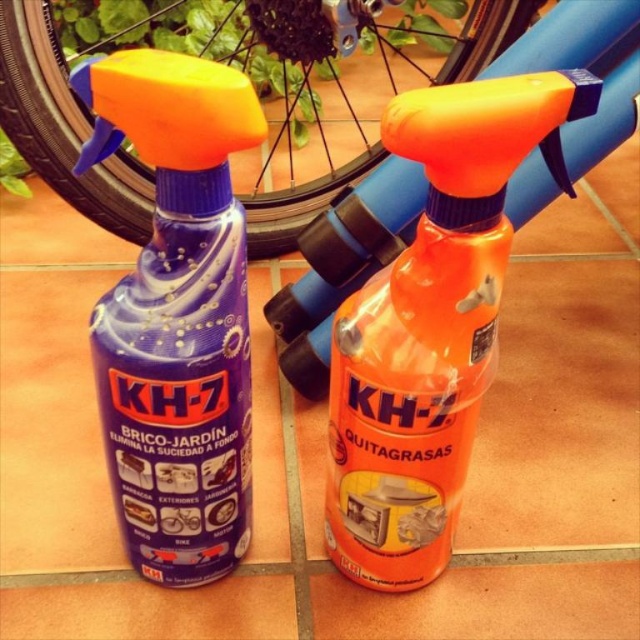
Does matte plastic spray bottle at left have a larger size compared to black rubber tire at upper center?

Actually, matte plastic spray bottle at left might be smaller than black rubber tire at upper center.

Image resolution: width=640 pixels, height=640 pixels. What do you see at coordinates (177, 316) in the screenshot?
I see `matte plastic spray bottle at left` at bounding box center [177, 316].

Which is in front, point (166, 422) or point (124, 211)?

Point (166, 422) is more forward.

This screenshot has width=640, height=640. What are the coordinates of `matte plastic spray bottle at left` in the screenshot? It's located at (177, 316).

Which is behind, point (387, 410) or point (42, 99)?

The point (42, 99) is more distant.

Which is more to the right, orange matte spray bottle at center or black rubber tire at upper center?

From the viewer's perspective, orange matte spray bottle at center appears more on the right side.

What do you see at coordinates (433, 323) in the screenshot? I see `orange matte spray bottle at center` at bounding box center [433, 323].

This screenshot has height=640, width=640. In order to click on orange matte spray bottle at center in this screenshot , I will do `click(433, 323)`.

Does matte plastic spray bottle at left have a lesser width compared to orange matte spray bottle at center?

Yes.

I want to click on matte plastic spray bottle at left, so click(x=177, y=316).

This screenshot has width=640, height=640. Identify the location of matte plastic spray bottle at left. (177, 316).

You are a GUI agent. You are given a task and a screenshot of the screen. Output one action in this format:
    pyautogui.click(x=<x>, y=<y>)
    Task: Click on the matte plastic spray bottle at left
    This screenshot has height=640, width=640.
    Given the screenshot: What is the action you would take?
    pyautogui.click(x=177, y=316)